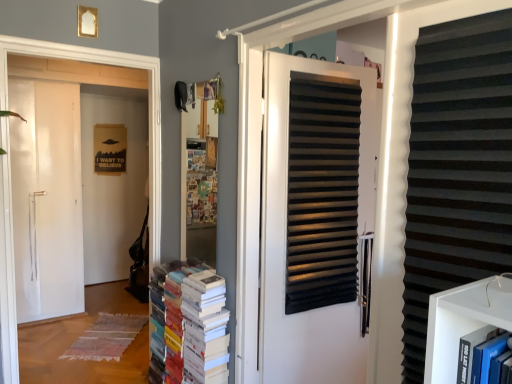
Question: Is black corrugated plastic at right thinner than multicolored paper books at center?

Choices:
 (A) yes
 (B) no

Answer: (A)

Question: Is the surface of black corrugated plastic at right in direct contact with multicolored paper books at center?

Choices:
 (A) yes
 (B) no

Answer: (B)

Question: Does black corrugated plastic at right have a larger size compared to multicolored paper books at center?

Choices:
 (A) no
 (B) yes

Answer: (A)

Question: Can you confirm if black corrugated plastic at right is shorter than multicolored paper books at center?

Choices:
 (A) yes
 (B) no

Answer: (B)

Question: Considering the relative sizes of black corrugated plastic at right and multicolored paper books at center in the image provided, is black corrugated plastic at right taller than multicolored paper books at center?

Choices:
 (A) yes
 (B) no

Answer: (A)

Question: Is multicolored paper books at center inside black corrugated plastic at right?

Choices:
 (A) no
 (B) yes

Answer: (A)

Question: From the image's perspective, is white matte door at left beneath multicolored paper books at center?

Choices:
 (A) no
 (B) yes

Answer: (A)

Question: Is white matte door at left further to camera compared to multicolored paper books at center?

Choices:
 (A) yes
 (B) no

Answer: (A)

Question: Is the position of white matte door at left less distant than that of multicolored paper books at center?

Choices:
 (A) no
 (B) yes

Answer: (A)

Question: Is white matte door at left positioned beyond the bounds of multicolored paper books at center?

Choices:
 (A) no
 (B) yes

Answer: (B)

Question: Is white matte door at left smaller than multicolored paper books at center?

Choices:
 (A) no
 (B) yes

Answer: (A)

Question: Can you confirm if white matte door at left is positioned to the right of multicolored paper books at center?

Choices:
 (A) yes
 (B) no

Answer: (B)

Question: Considering the relative positions of black corrugated plastic at right and white matte door at center in the image provided, is black corrugated plastic at right in front of white matte door at center?

Choices:
 (A) no
 (B) yes

Answer: (B)